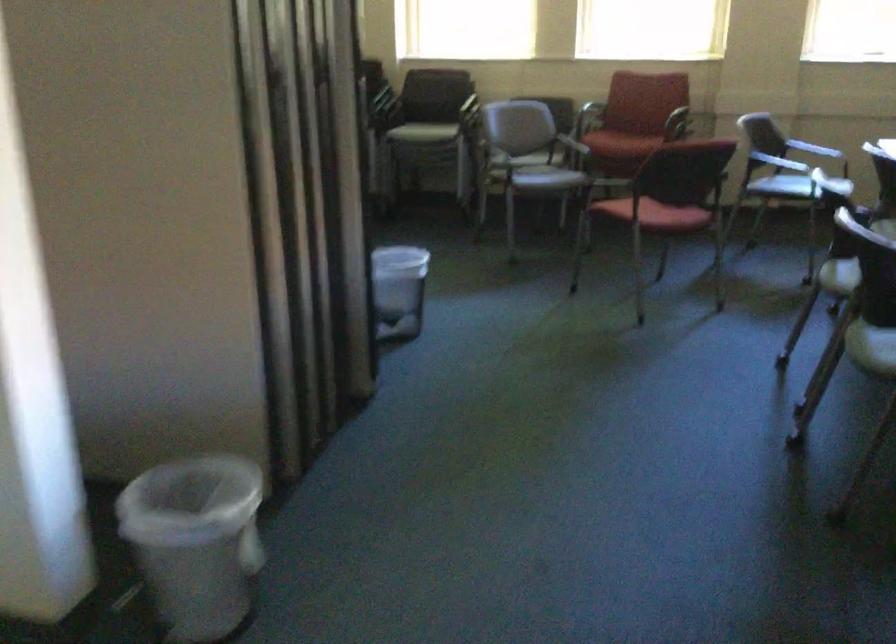
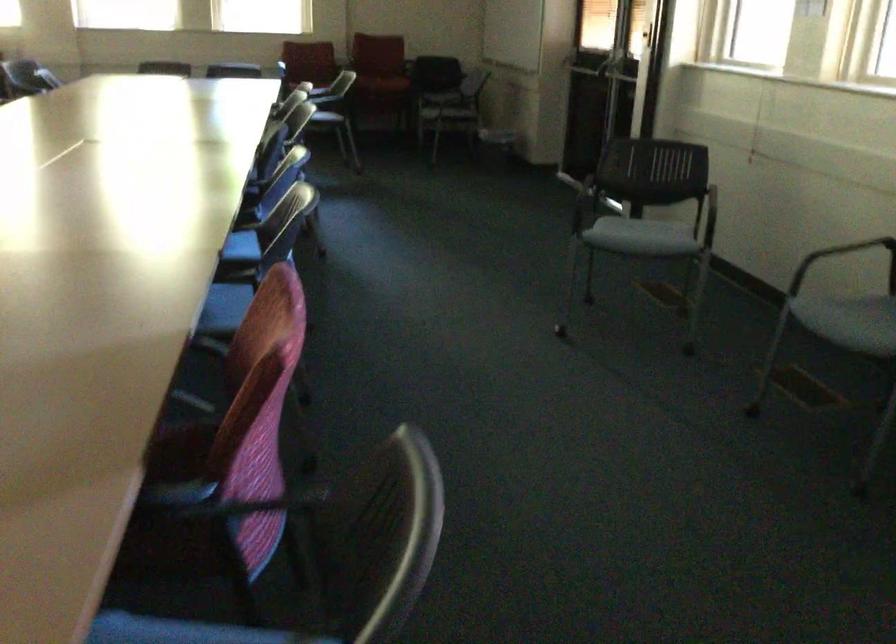
What movement of the cameraman would produce the second image?

The movement direction of the cameraman is right, backward.